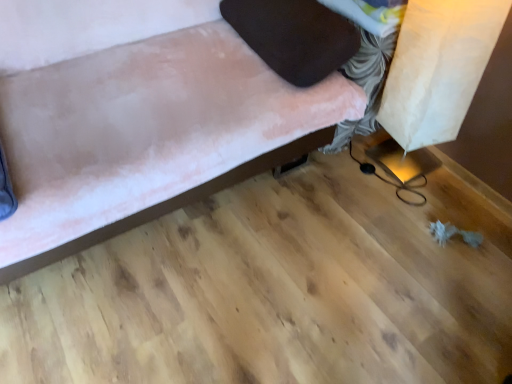
Question: From a real-world perspective, does velvet brown pillow at upper right stand above velvet pink couch at upper left?

Choices:
 (A) no
 (B) yes

Answer: (B)

Question: Does velvet brown pillow at upper right have a larger size compared to velvet pink couch at upper left?

Choices:
 (A) no
 (B) yes

Answer: (A)

Question: Can you confirm if velvet brown pillow at upper right is thinner than velvet pink couch at upper left?

Choices:
 (A) yes
 (B) no

Answer: (A)

Question: Can velvet pink couch at upper left be found inside velvet brown pillow at upper right?

Choices:
 (A) yes
 (B) no

Answer: (B)

Question: From a real-world perspective, does velvet brown pillow at upper right sit lower than velvet pink couch at upper left?

Choices:
 (A) yes
 (B) no

Answer: (B)

Question: Is velvet brown pillow at upper right taller than velvet pink couch at upper left?

Choices:
 (A) yes
 (B) no

Answer: (B)

Question: Is velvet pink couch at upper left completely or partially outside of velvet brown pillow at upper right?

Choices:
 (A) yes
 (B) no

Answer: (A)

Question: Is velvet pink couch at upper left oriented towards velvet brown pillow at upper right?

Choices:
 (A) yes
 (B) no

Answer: (B)

Question: Is velvet pink couch at upper left touching velvet brown pillow at upper right?

Choices:
 (A) no
 (B) yes

Answer: (A)

Question: From the image's perspective, would you say velvet pink couch at upper left is shown under velvet brown pillow at upper right?

Choices:
 (A) yes
 (B) no

Answer: (A)

Question: Is velvet pink couch at upper left far away from velvet brown pillow at upper right?

Choices:
 (A) yes
 (B) no

Answer: (B)

Question: From the image's perspective, is velvet pink couch at upper left located above velvet brown pillow at upper right?

Choices:
 (A) no
 (B) yes

Answer: (A)

Question: Is point (284, 26) positioned closer to the camera than point (111, 59)?

Choices:
 (A) farther
 (B) closer

Answer: (B)